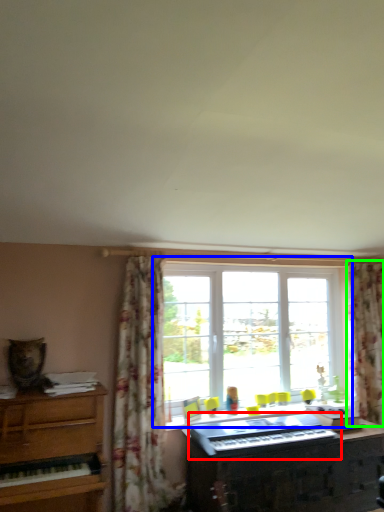
Question: Which object is positioned farthest from musical keyboard (highlighted by a red box)? Select from window (highlighted by a blue box) and curtain (highlighted by a green box).

Choices:
 (A) window
 (B) curtain

Answer: (B)